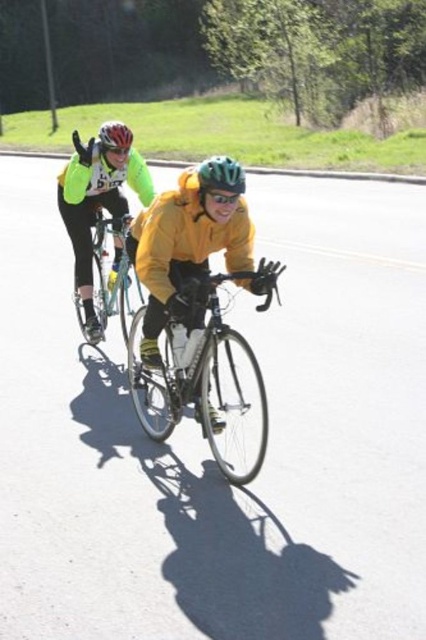
You are a photographer standing at the starting line of a cycling race. You want to take a photo that includes both cyclists. The cyclists are at point [184,259] and point [199,172]. Which cyclist is closer to your camera?

Point [184,259] is further to the camera than point [199,172], so the cyclist at point [199,172] is closer to the camera.

You are a photographer trying to capture both the yellow matte jacket at center and the shiny metallic bicycle at center in a single shot. Based on their positions, which object should you adjust your camera to focus on first to ensure both are in frame?

The yellow matte jacket at center is to the left of the shiny metallic bicycle at center, so you should focus on the shiny metallic bicycle at center first to ensure both are in frame.

You are a pedestrian standing at the side of the road observing two cyclists. You notice the yellow matte jacket at center and the green matte bicycle helmet at center. Which object is positioned more to the left?

The yellow matte jacket at center is positioned to the left of the green matte bicycle helmet at center.